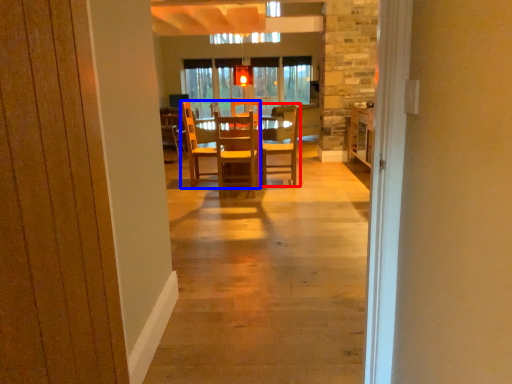
Question: Among these objects, which one is nearest to the camera, chair (highlighted by a red box) or chair (highlighted by a blue box)?

Choices:
 (A) chair
 (B) chair

Answer: (B)